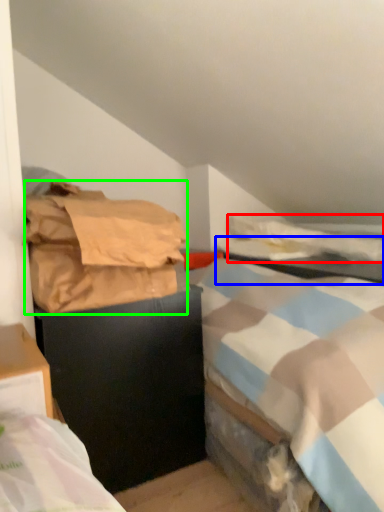
Question: Based on their relative distances, which object is nearer to blanket (highlighted by a red box)? Choose from table (highlighted by a blue box) and material (highlighted by a green box).

Choices:
 (A) table
 (B) material

Answer: (A)